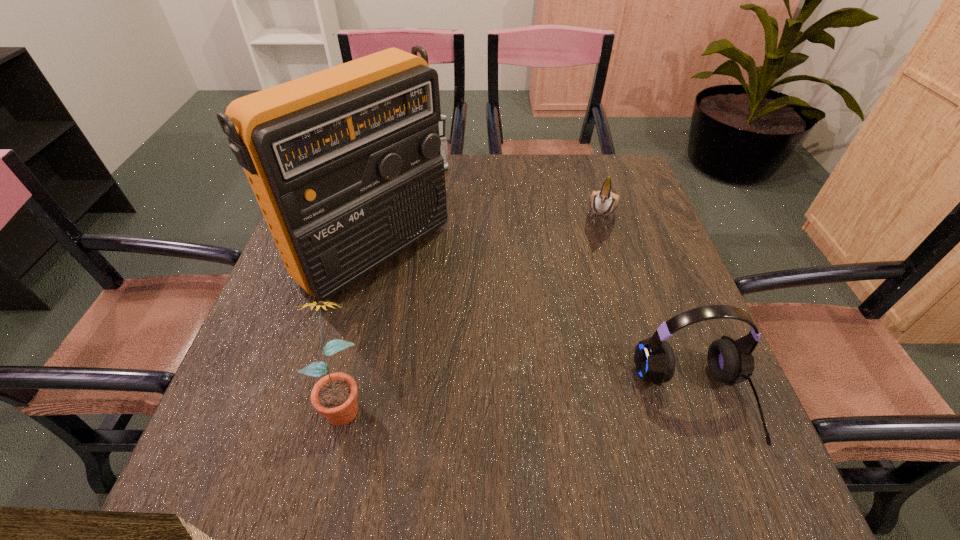
At what (x,y) coordinates should I click in order to perform the action: click on blank space located 0.280m on the front-facing side of the tallest object. Please return your answer as a coordinate pair (x, y). Image resolution: width=960 pixels, height=540 pixels. Looking at the image, I should click on (517, 361).

At what (x,y) coordinates should I click in order to perform the action: click on vacant space located 0.370m on the front-facing side of the farthest object. Please return your answer as a coordinate pair (x, y). Image resolution: width=960 pixels, height=540 pixels. Looking at the image, I should click on (479, 255).

Where is `free space located on the front-facing side of the farthest object`? The image size is (960, 540). free space located on the front-facing side of the farthest object is located at coordinates (468, 230).

Find the location of a particular element. The height and width of the screenshot is (540, 960). vacant space positioned on the front-facing side of the farthest object is located at coordinates (479, 255).

I want to click on bird at the far edge, so click(603, 202).

You are a GUI agent. You are given a task and a screenshot of the screen. Output one action in this format:
    pyautogui.click(x=<x>, y=<y>)
    Task: Click on the cellular telephone that is at the far edge
    This screenshot has height=540, width=960.
    Given the screenshot: What is the action you would take?
    pyautogui.click(x=442, y=124)

Where is `sunflower that is positioned at the near edge`? sunflower that is positioned at the near edge is located at coordinates (334, 396).

You are a GUI agent. You are given a task and a screenshot of the screen. Output one action in this format:
    pyautogui.click(x=<x>, y=<y>)
    Task: Click on the headset present at the near edge
    
    Given the screenshot: What is the action you would take?
    pyautogui.click(x=730, y=361)

Find the location of a particular element. This screenshot has height=540, width=960. object that is at the left edge is located at coordinates (345, 163).

This screenshot has height=540, width=960. I want to click on headset at the right edge, so click(730, 361).